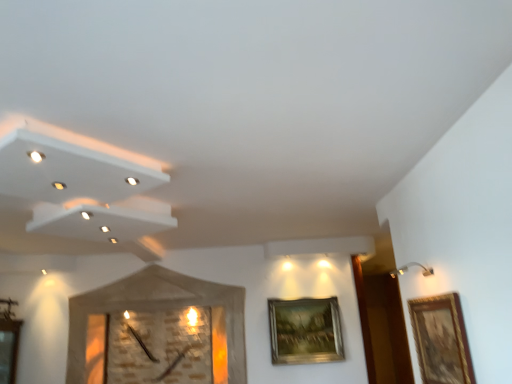
Question: Is wooden textured clock at center outside gold metallic picture frame at upper right, marked as the 1th picture frame in a bottom-to-top arrangement?

Choices:
 (A) no
 (B) yes

Answer: (B)

Question: Is wooden textured clock at center positioned far away from gold metallic picture frame at upper right, marked as the 1th picture frame in a bottom-to-top arrangement?

Choices:
 (A) yes
 (B) no

Answer: (B)

Question: Is wooden textured clock at center at the left side of gold metallic picture frame at upper right, the 1th picture frame from the left?

Choices:
 (A) no
 (B) yes

Answer: (B)

Question: Is wooden textured clock at center bigger than gold metallic picture frame at upper right, the 1th picture frame from the left?

Choices:
 (A) no
 (B) yes

Answer: (B)

Question: Is the depth of wooden textured clock at center greater than that of gold metallic picture frame at upper right, positioned as the 2th picture frame in top-to-bottom order?

Choices:
 (A) no
 (B) yes

Answer: (A)

Question: Would you say gold metallic picture frame at upper right, marked as the 1th picture frame in a bottom-to-top arrangement, is to the left or to the right of wooden textured clock at center in the picture?

Choices:
 (A) right
 (B) left

Answer: (A)

Question: Is gold metallic picture frame at upper right, positioned as the 2th picture frame in top-to-bottom order, taller or shorter than wooden textured clock at center?

Choices:
 (A) short
 (B) tall

Answer: (A)

Question: Considering the positions of point (301, 360) and point (97, 306), is point (301, 360) closer or farther from the camera than point (97, 306)?

Choices:
 (A) farther
 (B) closer

Answer: (B)

Question: Considering the positions of gold metallic picture frame at upper right, marked as the 1th picture frame in a bottom-to-top arrangement, and wooden textured clock at center in the image, is gold metallic picture frame at upper right, marked as the 1th picture frame in a bottom-to-top arrangement, wider or thinner than wooden textured clock at center?

Choices:
 (A) thin
 (B) wide

Answer: (A)

Question: From the image's perspective, is wooden textured clock at center positioned above or below gold metallic picture frame at upper right, the 2th picture frame viewed from the right?

Choices:
 (A) above
 (B) below

Answer: (A)

Question: In terms of height, does wooden textured clock at center look taller or shorter compared to gold metallic picture frame at upper right, marked as the 1th picture frame in a bottom-to-top arrangement?

Choices:
 (A) short
 (B) tall

Answer: (B)

Question: In terms of size, does wooden textured clock at center appear bigger or smaller than gold metallic picture frame at upper right, marked as the 1th picture frame in a bottom-to-top arrangement?

Choices:
 (A) big
 (B) small

Answer: (A)

Question: Which is correct: wooden textured clock at center is inside gold metallic picture frame at upper right, the 2th picture frame viewed from the right, or outside of it?

Choices:
 (A) outside
 (B) inside

Answer: (A)

Question: Is gold metallic picture frame at upper right, arranged as the first picture frame when viewed from the back, situated inside gold-framed painting at right, the 1th picture frame from the right, or outside?

Choices:
 (A) inside
 (B) outside

Answer: (B)

Question: From a real-world perspective, is gold metallic picture frame at upper right, marked as the 1th picture frame in a bottom-to-top arrangement, positioned above or below gold-framed painting at right, the 1th picture frame positioned from the top?

Choices:
 (A) above
 (B) below

Answer: (A)